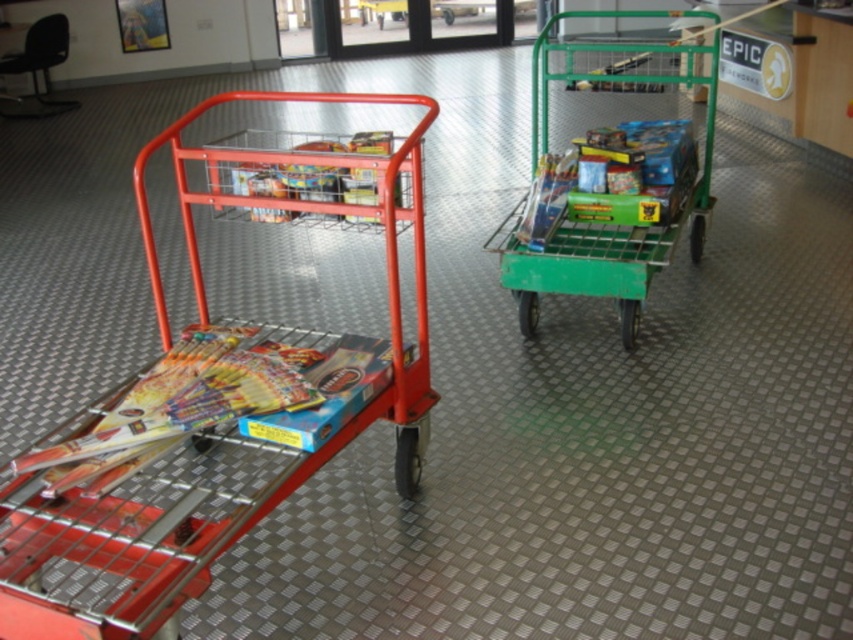
Which is behind, point (68, 532) or point (624, 42)?

The point (624, 42) is behind.

Who is shorter, metallic red shopping cart at left or green metal trolley at right?

With less height is metallic red shopping cart at left.

The height and width of the screenshot is (640, 853). I want to click on metallic red shopping cart at left, so click(x=218, y=394).

Locate an element on the screen. This screenshot has width=853, height=640. metallic red shopping cart at left is located at coordinates point(218,394).